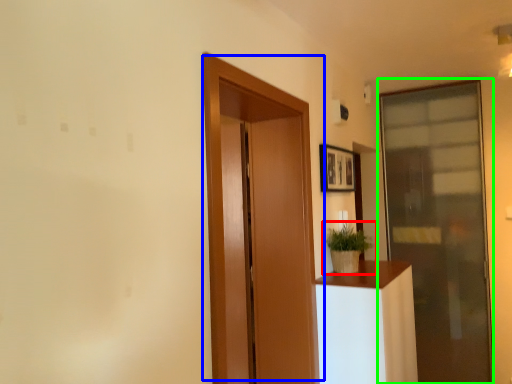
Question: Based on their relative distances, which object is nearer to houseplant (highlighted by a red box)? Choose from door (highlighted by a blue box) and door (highlighted by a green box).

Choices:
 (A) door
 (B) door

Answer: (A)